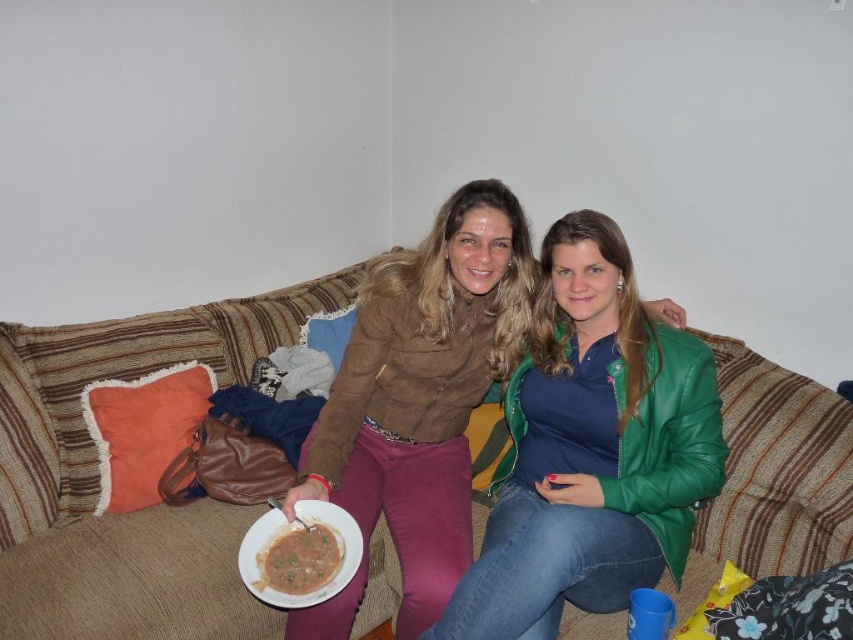
Looking at this image, which is more to the left, brown fabric couch at center or brown matte bowl at center?

brown fabric couch at center is more to the left.

Is point (167, 532) in front of point (308, 545)?

No, (167, 532) is further to viewer.

Where is `brown fabric couch at center`? This screenshot has width=853, height=640. brown fabric couch at center is located at coordinates (97, 476).

The width and height of the screenshot is (853, 640). What do you see at coordinates (97, 476) in the screenshot? I see `brown fabric couch at center` at bounding box center [97, 476].

Does point (326, 300) lie in front of point (656, 381)?

No, (326, 300) is further to viewer.

Identify the location of brown fabric couch at center. (97, 476).

Which is more to the right, green leather jacket at center or white matte bowl at center?

green leather jacket at center is more to the right.

Is green leather jacket at center taller than white matte bowl at center?

Yes.

Does point (567, 572) come behind point (335, 540)?

No, (567, 572) is closer to viewer.

This screenshot has width=853, height=640. Find the location of `green leather jacket at center`. green leather jacket at center is located at coordinates click(x=590, y=449).